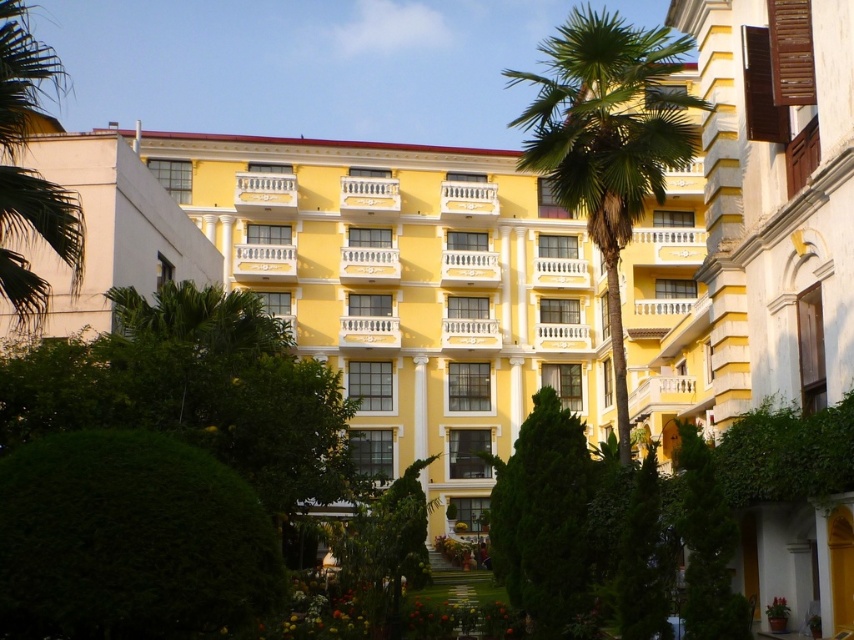
How distant is yellow matte building at upper right from green leafy palm tree at center?

yellow matte building at upper right is 13.20 meters away from green leafy palm tree at center.

Between point (828, 108) and point (610, 72), which one is positioned behind?

The point (610, 72) is more distant.

The width and height of the screenshot is (854, 640). What do you see at coordinates (776, 196) in the screenshot?
I see `yellow matte building at upper right` at bounding box center [776, 196].

Find the location of a particular element. The image size is (854, 640). yellow matte building at upper right is located at coordinates click(776, 196).

This screenshot has width=854, height=640. What do you see at coordinates (542, 518) in the screenshot?
I see `green textured tree at center` at bounding box center [542, 518].

Does point (510, 538) come in front of point (715, 589)?

No.

I want to click on green textured tree at center, so click(x=542, y=518).

Is yellow matte building at upper right thinner than green leafy tree at lower right?

Correct, yellow matte building at upper right's width is less than green leafy tree at lower right's.

Does yellow matte building at upper right have a greater width compared to green leafy tree at lower right?

No.

Does point (825, 598) come behind point (712, 582)?

Yes, point (825, 598) is behind point (712, 582).

The width and height of the screenshot is (854, 640). What are the coordinates of `yellow matte building at upper right` in the screenshot? It's located at (776, 196).